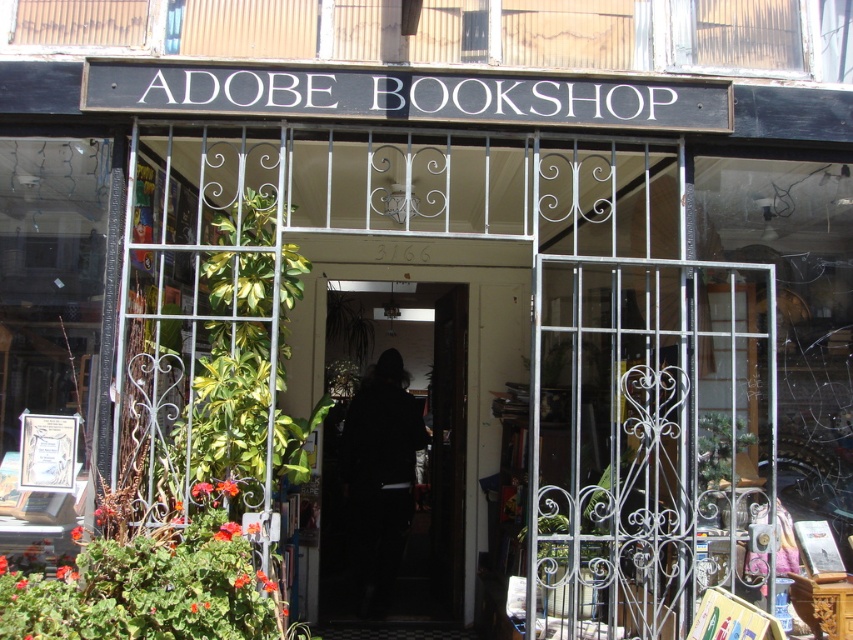
You are standing outside the Adobe Bookshop entrance and want to enter. The metallic wrought iron gate at center is your only entrance option. Can you walk through it?

The metallic wrought iron gate at center is open, so yes, you can walk through it.

You are standing outside the Adobe Bookshop and want to take a photo of the entrance. The camera you have can only focus on objects within 4 meters. Is the metallic wrought iron gate at center within the camera focus range?

The metallic wrought iron gate at center and camera are 4.22 meters apart, so the gate is slightly out of the camera focus range since it exceeds the 4 meter limit.

You are standing outside the Adobe Bookshop entrance and want to enter. Which object must you pass through first, the metallic wrought iron gate at center or the black fabric door at center?

The metallic wrought iron gate at center is above the black fabric door at center, so you must pass through the black fabric door at center first before the gate.